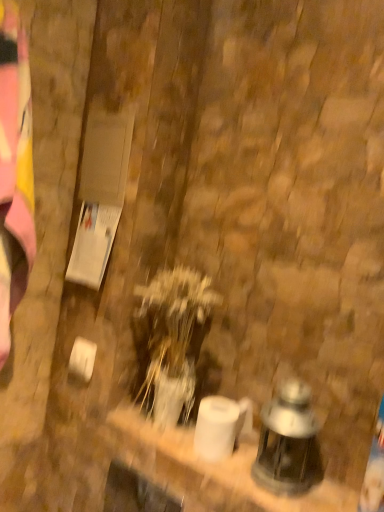
Where is `vacant space positioned to the left of matte glass lantern at lower right`? vacant space positioned to the left of matte glass lantern at lower right is located at coordinates (213, 457).